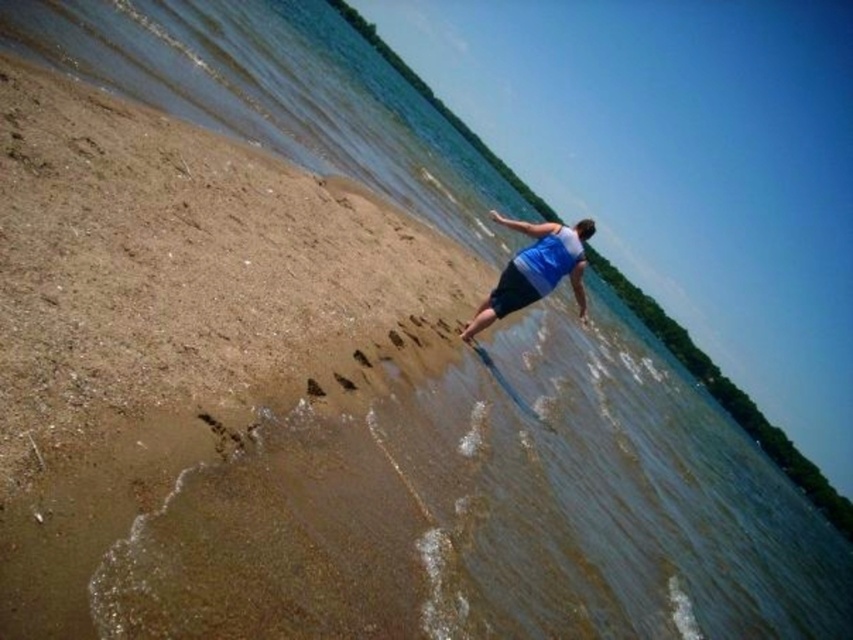
You are designing a life jacket for the blue fabric man at center and the blue fabric shorts at center. The life jacket must fit snugly around the waist. Which object should you measure to ensure the life jacket fits properly?

You should measure the blue fabric man at center because its width is larger than the blue fabric shorts at center, ensuring the life jacket accommodates the wider waist measurement.

You are standing at the point marked by coordinates (535, 269) on the blue fabric man at center. Which direction should you face to see the water?

The point marked by coordinates (535, 269) is on the blue fabric man at center. Since the man is facing the water, you should face the direction the man is facing to see the water.